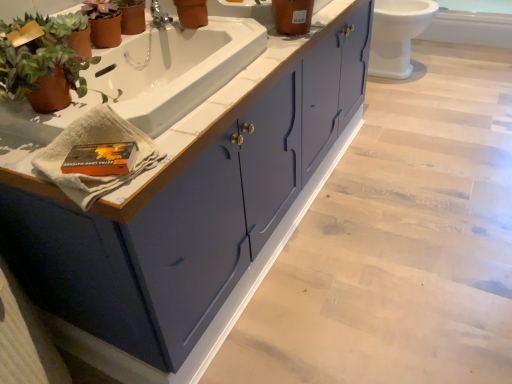
Identify the location of white glossy toilet at upper right. This screenshot has height=384, width=512. (397, 35).

Where is `silver metallic faucet at upper center`? silver metallic faucet at upper center is located at coordinates (159, 15).

Is point (166, 15) behind point (59, 47)?

Yes.

From the image's perspective, is silver metallic faucet at upper center on top of terracotta clay pot at left?

Yes.

Is the position of silver metallic faucet at upper center less distant than that of terracotta clay pot at left?

No, the depth of silver metallic faucet at upper center is greater than that of terracotta clay pot at left.

In the scene shown: Is the surface of white glossy toilet at upper right in direct contact with white glossy sink at upper center?

white glossy toilet at upper right and white glossy sink at upper center are not in contact.

Between white glossy toilet at upper right and white glossy sink at upper center, which one appears on the left side from the viewer's perspective?

Positioned to the left is white glossy sink at upper center.

From the image's perspective, is white glossy toilet at upper right located above white glossy sink at upper center?

Correct, white glossy toilet at upper right appears higher than white glossy sink at upper center in the image.

Which object is further away from the camera taking this photo, white glossy toilet at upper right or white glossy sink at upper center?

white glossy toilet at upper right.

Does point (40, 98) come farther from viewer compared to point (197, 166)?

No, (40, 98) is in front of (197, 166).

Is terracotta clay pot at left next to matte blue cabinet at center?

No, terracotta clay pot at left is not beside matte blue cabinet at center.

Is terracotta clay pot at left looking in the opposite direction of matte blue cabinet at center?

No.

Which object is thinner, terracotta clay pot at left or matte blue cabinet at center?

terracotta clay pot at left.

Considering the sizes of matte orange pot at upper center and white glossy toilet at upper right in the image, is matte orange pot at upper center bigger or smaller than white glossy toilet at upper right?

Considering their sizes, matte orange pot at upper center takes up less space than white glossy toilet at upper right.

How different are the orientations of matte orange pot at upper center and white glossy toilet at upper right in degrees?

matte orange pot at upper center and white glossy toilet at upper right are facing 4.62 degrees away from each other.

Considering the sizes of objects matte orange pot at upper center and white glossy toilet at upper right in the image provided, who is wider, matte orange pot at upper center or white glossy toilet at upper right?

With larger width is white glossy toilet at upper right.

Is matte orange pot at upper center oriented towards white glossy toilet at upper right?

No, matte orange pot at upper center does not turn towards white glossy toilet at upper right.

Where is `toilet behind the matte blue cabinet at center`? The height and width of the screenshot is (384, 512). toilet behind the matte blue cabinet at center is located at coordinates (397, 35).

Is white glossy toilet at upper right at the back of matte blue cabinet at center?

No, matte blue cabinet at center is not facing away from white glossy toilet at upper right.

Based on the photo, from the image's perspective, which is above, matte blue cabinet at center or white glossy toilet at upper right?

white glossy toilet at upper right, from the image's perspective.

Does matte blue cabinet at center appear on the left side of white glossy toilet at upper right?

Yes, matte blue cabinet at center is to the left of white glossy toilet at upper right.

How different are the orientations of white glossy toilet at upper right and silver metallic faucet at upper center in degrees?

27.9 degrees separate the facing orientations of white glossy toilet at upper right and silver metallic faucet at upper center.

Is white glossy toilet at upper right positioned before silver metallic faucet at upper center?

No, the depth of white glossy toilet at upper right is greater than that of silver metallic faucet at upper center.

Is white glossy toilet at upper right inside or outside of silver metallic faucet at upper center?

white glossy toilet at upper right lies outside silver metallic faucet at upper center.

Is white glossy toilet at upper right shorter than silver metallic faucet at upper center?

Incorrect, the height of white glossy toilet at upper right does not fall short of that of silver metallic faucet at upper center.

Can you confirm if terracotta clay pot at left is positioned to the right of matte orange pot at upper center?

Incorrect, terracotta clay pot at left is not on the right side of matte orange pot at upper center.

How far apart are terracotta clay pot at left and matte orange pot at upper center?

The distance of terracotta clay pot at left from matte orange pot at upper center is 18.27 inches.

Is terracotta clay pot at left turned away from matte orange pot at upper center?

No, terracotta clay pot at left's orientation is not away from matte orange pot at upper center.

Where is `tap below the terracotta clay pot at left (from a real-world perspective)`? tap below the terracotta clay pot at left (from a real-world perspective) is located at coordinates (159, 15).

Identify the location of toilet behind the white glossy sink at upper center. This screenshot has height=384, width=512. (397, 35).

From the image, which object appears to be farther from matte orange pot at upper center, matte blue cabinet at center or white glossy sink at upper center?

Result: Among the two, matte blue cabinet at center is located further to matte orange pot at upper center.

When comparing their distances from matte blue cabinet at center, does terracotta clay pot at left or matte orange pot at upper center seem closer?

terracotta clay pot at left.

Looking at this image, from the image, which object appears to be farther from silver metallic faucet at upper center, matte orange pot at upper center or matte blue cabinet at center?

matte blue cabinet at center is positioned further to the anchor silver metallic faucet at upper center.

In the scene shown: Estimate the real-world distances between objects in this image. Which object is closer to matte blue cabinet at center, silver metallic faucet at upper center or white glossy sink at upper center?

The object closer to matte blue cabinet at center is white glossy sink at upper center.

Considering their positions, is matte blue cabinet at center positioned further to terracotta clay pot at left than white glossy sink at upper center?

The object further to terracotta clay pot at left is matte blue cabinet at center.

Based on their spatial positions, is white glossy sink at upper center or white glossy toilet at upper right closer to matte blue cabinet at center?

white glossy sink at upper center lies closer to matte blue cabinet at center than the other object.

When comparing their distances from silver metallic faucet at upper center, does matte blue cabinet at center or matte orange pot at upper center seem closer?

matte orange pot at upper center.

Considering their positions, is matte orange pot at upper center positioned further to silver metallic faucet at upper center than white glossy sink at upper center?

The object further to silver metallic faucet at upper center is white glossy sink at upper center.

Identify the location of tap between white glossy sink at upper center and white glossy toilet at upper right along the z-axis. (159, 15).

Image resolution: width=512 pixels, height=384 pixels. Identify the location of sink located between matte blue cabinet at center and white glossy toilet at upper right in the depth direction. (176, 69).

Identify the location of bathroom cabinet between terracotta clay pot at left and silver metallic faucet at upper center along the z-axis. The width and height of the screenshot is (512, 384). (190, 214).

You are a GUI agent. You are given a task and a screenshot of the screen. Output one action in this format:
    pyautogui.click(x=<x>, y=<y>)
    Task: Click on the toilet bowl positioned between matte blue cabinet at center and white glossy toilet at upper right from near to far
    The width and height of the screenshot is (512, 384).
    Given the screenshot: What is the action you would take?
    pyautogui.click(x=192, y=13)